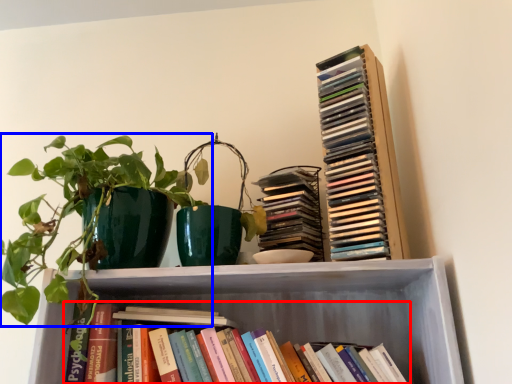
Question: Among these objects, which one is farthest to the camera, book (highlighted by a red box) or houseplant (highlighted by a blue box)?

Choices:
 (A) book
 (B) houseplant

Answer: (A)